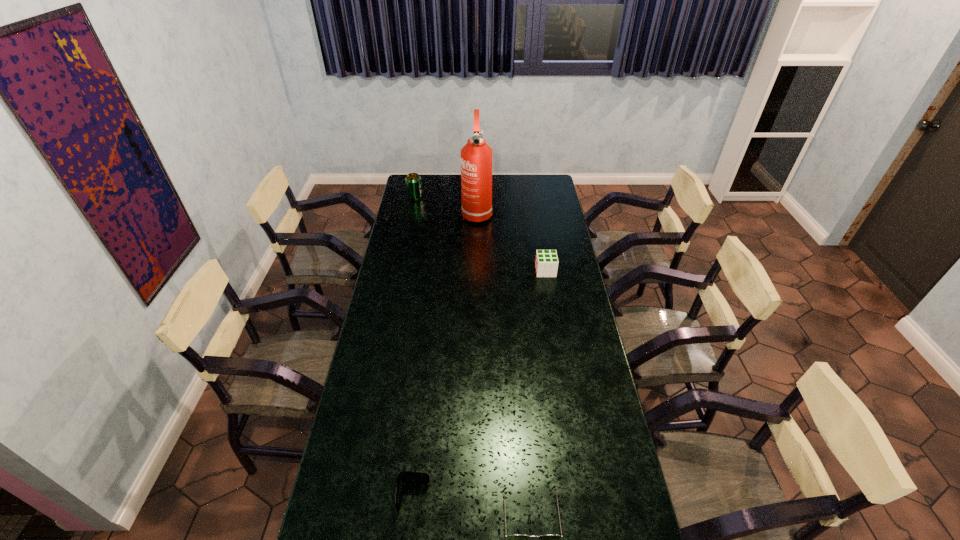
Locate an element on the screen. Image resolution: width=960 pixels, height=540 pixels. object that is the fourth closest to the wallet is located at coordinates (412, 180).

Identify which object is the third closest to the third object from right to left. Please provide its 2D coordinates. Your answer should be formatted as a tuple, i.e. [(x, y)], where the tuple contains the x and y coordinates of a point satisfying the conditions above.

[(403, 477)]